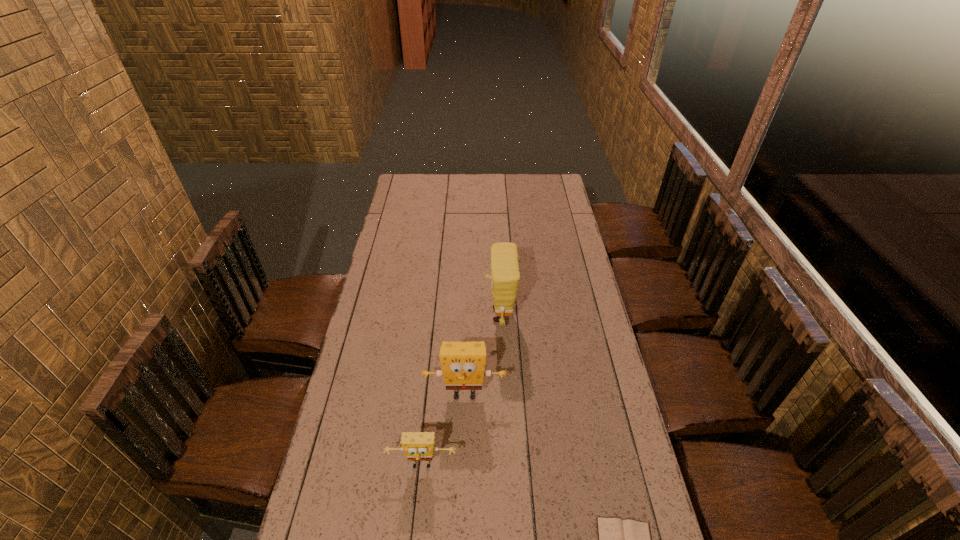
You are a GUI agent. You are given a task and a screenshot of the screen. Output one action in this format:
    pyautogui.click(x=<x>, y=<y>)
    Task: Click on the object that is the second nearest to the second tallest object
    Image resolution: width=960 pixels, height=540 pixels.
    Given the screenshot: What is the action you would take?
    pyautogui.click(x=505, y=275)

This screenshot has height=540, width=960. I want to click on object that is the third nearest to the second shortest object, so click(x=505, y=275).

Select which sponge is the second closest to the tallest object. Please provide its 2D coordinates. Your answer should be formatted as a tuple, i.e. [(x, y)], where the tuple contains the x and y coordinates of a point satisfying the conditions above.

[(418, 446)]

This screenshot has width=960, height=540. I want to click on sponge that is the second closest to the nearest object, so click(463, 363).

Find the location of a particular element. vacant point that satisfies the following two spatial constraints: 1. on the face of the farthest sponge; 2. on the face of the second nearest sponge is located at coordinates (504, 395).

This screenshot has height=540, width=960. I want to click on vacant space that satisfies the following two spatial constraints: 1. on the face of the tallest sponge; 2. on the face of the third shortest object, so click(x=504, y=395).

Locate an element on the screen. vacant area in the image that satisfies the following two spatial constraints: 1. on the face of the tallest sponge; 2. on the face of the third nearest object is located at coordinates (504, 395).

Identify the location of free space that satisfies the following two spatial constraints: 1. on the face of the farthest sponge; 2. on the face of the second tallest object. (504, 395).

Locate an element on the screen. Image resolution: width=960 pixels, height=540 pixels. free spot that satisfies the following two spatial constraints: 1. on the face of the tallest sponge; 2. on the face of the second nearest sponge is located at coordinates (504, 395).

The image size is (960, 540). What are the coordinates of `vacant space that satisfies the following two spatial constraints: 1. on the face of the farthest sponge; 2. on the face of the second farthest sponge` in the screenshot? It's located at (504, 395).